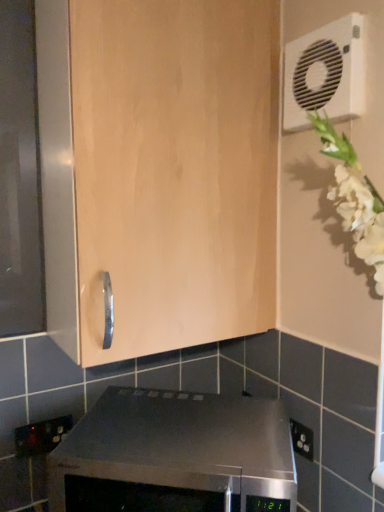
Find the location of `white plastic air conditioning unit at upper right`. white plastic air conditioning unit at upper right is located at coordinates (325, 74).

The width and height of the screenshot is (384, 512). Identify the location of satin black oven at lower center. (175, 455).

This screenshot has height=512, width=384. What are the coordinates of `white plastic air conditioning unit at upper right` in the screenshot? It's located at (325, 74).

Is light wood cabinet at center directly adjacent to white plastic air conditioning unit at upper right?

No, light wood cabinet at center is not beside white plastic air conditioning unit at upper right.

Considering the relative sizes of light wood cabinet at center and white plastic air conditioning unit at upper right in the image provided, is light wood cabinet at center smaller than white plastic air conditioning unit at upper right?

Actually, light wood cabinet at center might be larger than white plastic air conditioning unit at upper right.

Is light wood cabinet at center not inside white plastic air conditioning unit at upper right?

Absolutely, light wood cabinet at center is external to white plastic air conditioning unit at upper right.

Considering the relative sizes of white plastic air conditioning unit at upper right and satin black oven at lower center in the image provided, is white plastic air conditioning unit at upper right wider than satin black oven at lower center?

No, white plastic air conditioning unit at upper right is not wider than satin black oven at lower center.

Is there a large distance between white plastic air conditioning unit at upper right and satin black oven at lower center?

No, white plastic air conditioning unit at upper right is not far away from satin black oven at lower center.

From the image's perspective, is white plastic air conditioning unit at upper right beneath satin black oven at lower center?

Incorrect, from the image's perspective, white plastic air conditioning unit at upper right is higher than satin black oven at lower center.

Is satin black oven at lower center next to light wood cabinet at center?

No, satin black oven at lower center is not with light wood cabinet at center.

Measure the distance from satin black oven at lower center to light wood cabinet at center.

satin black oven at lower center is 15.37 inches away from light wood cabinet at center.

Considering the relative positions of satin black oven at lower center and light wood cabinet at center in the image provided, is satin black oven at lower center to the left of light wood cabinet at center from the viewer's perspective?

No.

Is point (60, 504) more distant than point (104, 161)?

That is True.

Based on the photo, which is closer to the camera, (344, 22) or (60, 438)?

The point (344, 22) is closer.

Do you think white plastic air conditioning unit at upper right is within black plastic electric outlet at lower left, or outside of it?

The correct answer is: outside.

In terms of size, does white plastic air conditioning unit at upper right appear bigger or smaller than black plastic electric outlet at lower left?

Considering their sizes, white plastic air conditioning unit at upper right takes up more space than black plastic electric outlet at lower left.

At what (x,y) coordinates should I click in order to perform the action: click on electric outlet behind the white plastic air conditioning unit at upper right. Please return your answer as a coordinate pair (x, y). This screenshot has width=384, height=512. Looking at the image, I should click on (41, 436).

How different are the orientations of light wood cabinet at center and black plastic electric outlet at lower left in degrees?

The angle between the facing direction of light wood cabinet at center and the facing direction of black plastic electric outlet at lower left is 0.0033 degrees.

Which is less distant, (266, 312) or (20, 446)?

Point (20, 446)

Which is behind, light wood cabinet at center or black plastic electric outlet at lower left?

black plastic electric outlet at lower left is further away from the camera.

In the scene shown: Is black plastic electric outlet at lower left thinner than light wood cabinet at center?

Indeed, black plastic electric outlet at lower left has a lesser width compared to light wood cabinet at center.

Is black plastic electric outlet at lower left taller than light wood cabinet at center?

No, black plastic electric outlet at lower left is not taller than light wood cabinet at center.

Considering their positions, is black plastic electric outlet at lower left located in front of or behind light wood cabinet at center?

black plastic electric outlet at lower left is behind light wood cabinet at center.

From the image's perspective, is black plastic electric outlet at lower left below light wood cabinet at center?

Yes, from the image's perspective, black plastic electric outlet at lower left is below light wood cabinet at center.

Looking at this image, is black plastic electric outlet at lower left shorter than white plastic air conditioning unit at upper right?

Correct, black plastic electric outlet at lower left is not as tall as white plastic air conditioning unit at upper right.

From a real-world perspective, is black plastic electric outlet at lower left over white plastic air conditioning unit at upper right?

No, from a real-world perspective, black plastic electric outlet at lower left is not above white plastic air conditioning unit at upper right.

In terms of width, does black plastic electric outlet at lower left look wider or thinner when compared to white plastic air conditioning unit at upper right?

black plastic electric outlet at lower left is thinner than white plastic air conditioning unit at upper right.

Identify the location of cabinetry located on the left of white plastic air conditioning unit at upper right. (158, 170).

Where is `air conditioning that appears above the satin black oven at lower center (from a real-world perspective)`? air conditioning that appears above the satin black oven at lower center (from a real-world perspective) is located at coordinates (x=325, y=74).

Which object lies further to the anchor point light wood cabinet at center, satin black oven at lower center or black plastic electric outlet at lower left?

black plastic electric outlet at lower left.

Looking at the image, which one is located closer to satin black oven at lower center, black plastic electric outlet at lower left or light wood cabinet at center?

black plastic electric outlet at lower left lies closer to satin black oven at lower center than the other object.

From the image, which object appears to be nearer to white plastic air conditioning unit at upper right, light wood cabinet at center or black plastic electric outlet at lower left?

light wood cabinet at center.

Which object lies further to the anchor point satin black oven at lower center, light wood cabinet at center or white plastic air conditioning unit at upper right?

white plastic air conditioning unit at upper right.

Estimate the real-world distances between objects in this image. Which object is further from black plastic electric outlet at lower left, white plastic air conditioning unit at upper right or light wood cabinet at center?

white plastic air conditioning unit at upper right lies further to black plastic electric outlet at lower left than the other object.

Estimate the real-world distances between objects in this image. Which object is closer to black plastic electric outlet at lower left, white plastic air conditioning unit at upper right or satin black oven at lower center?

satin black oven at lower center lies closer to black plastic electric outlet at lower left than the other object.

From the image, which object appears to be nearer to black plastic electric outlet at lower left, satin black oven at lower center or light wood cabinet at center?

satin black oven at lower center.

Estimate the real-world distances between objects in this image. Which object is further from light wood cabinet at center, black plastic electric outlet at lower left or white plastic air conditioning unit at upper right?

Among the two, black plastic electric outlet at lower left is located further to light wood cabinet at center.

Image resolution: width=384 pixels, height=512 pixels. In order to click on electric outlet between white plastic air conditioning unit at upper right and satin black oven at lower center vertically in this screenshot , I will do `click(41, 436)`.

Where is `electric outlet between light wood cabinet at center and satin black oven at lower center in the vertical direction`? This screenshot has width=384, height=512. electric outlet between light wood cabinet at center and satin black oven at lower center in the vertical direction is located at coordinates (41, 436).

Image resolution: width=384 pixels, height=512 pixels. Identify the location of cabinetry that lies between white plastic air conditioning unit at upper right and satin black oven at lower center from top to bottom. (158, 170).

The height and width of the screenshot is (512, 384). I want to click on cabinetry between white plastic air conditioning unit at upper right and black plastic electric outlet at lower left in the vertical direction, so click(158, 170).